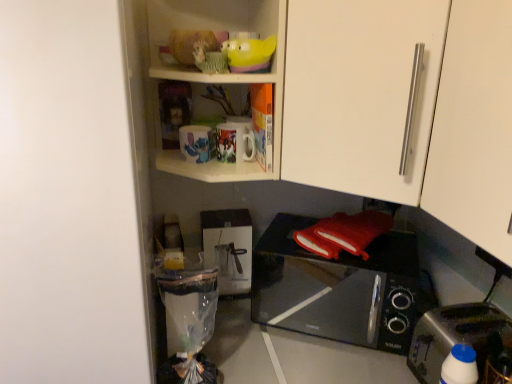
Question: Is translucent yellow bowl at upper center turned away from black glossy microwave oven at lower center?

Choices:
 (A) yes
 (B) no

Answer: (B)

Question: Is translucent yellow bowl at upper center far from black glossy microwave oven at lower center?

Choices:
 (A) yes
 (B) no

Answer: (B)

Question: Is translucent yellow bowl at upper center bigger than black glossy microwave oven at lower center?

Choices:
 (A) no
 (B) yes

Answer: (A)

Question: Is translucent yellow bowl at upper center aimed at black glossy microwave oven at lower center?

Choices:
 (A) no
 (B) yes

Answer: (A)

Question: Can you confirm if translucent yellow bowl at upper center is thinner than black glossy microwave oven at lower center?

Choices:
 (A) yes
 (B) no

Answer: (A)

Question: Considering the relative sizes of translucent yellow bowl at upper center and black glossy microwave oven at lower center in the image provided, is translucent yellow bowl at upper center shorter than black glossy microwave oven at lower center?

Choices:
 (A) yes
 (B) no

Answer: (A)

Question: Is white matte cabinet handle at upper right, the 2th cabinetry positioned from the back, closer to camera compared to white plastic bottle at lower right?

Choices:
 (A) no
 (B) yes

Answer: (B)

Question: Is white matte cabinet handle at upper right, the 2th cabinetry positioned from the back, with white plastic bottle at lower right?

Choices:
 (A) no
 (B) yes

Answer: (A)

Question: Is white matte cabinet handle at upper right, the 2th cabinetry positioned from the back, not near white plastic bottle at lower right?

Choices:
 (A) no
 (B) yes

Answer: (A)

Question: Is white matte cabinet handle at upper right, placed as the 1th cabinetry when sorted from front to back, further to the viewer compared to white plastic bottle at lower right?

Choices:
 (A) yes
 (B) no

Answer: (B)

Question: Can you confirm if white matte cabinet handle at upper right, the 2th cabinetry positioned from the back, is positioned to the right of white plastic bottle at lower right?

Choices:
 (A) no
 (B) yes

Answer: (B)

Question: From a real-world perspective, is white matte cabinet handle at upper right, placed as the 1th cabinetry when sorted from front to back, located beneath white plastic bottle at lower right?

Choices:
 (A) yes
 (B) no

Answer: (B)

Question: From the image's perspective, is matte ceramic mugs at upper center below black glossy microwave oven at lower center?

Choices:
 (A) no
 (B) yes

Answer: (A)